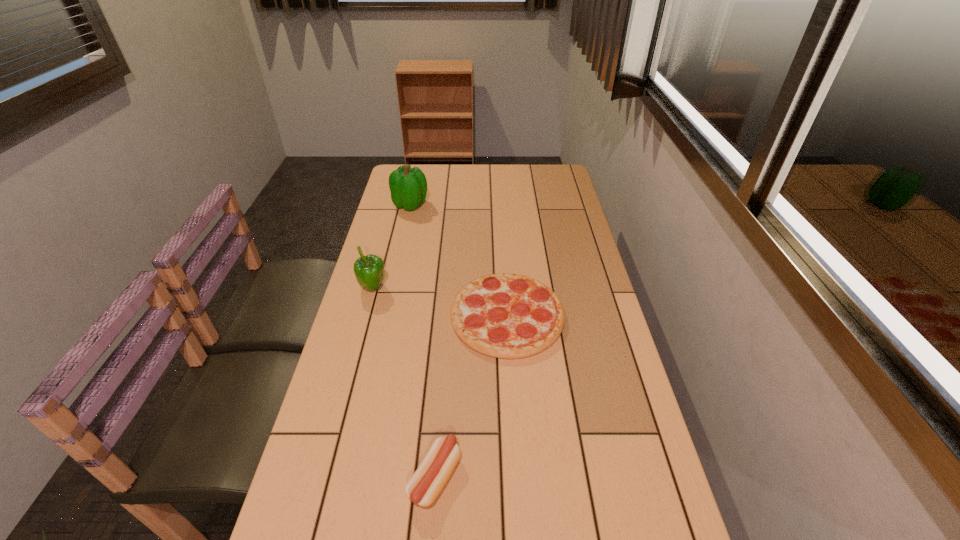
Locate an element on the screen. The height and width of the screenshot is (540, 960). vacant area that lies between the shortest object and the nearer bell pepper is located at coordinates (440, 302).

Where is `unoccupied area between the pizza and the farther bell pepper`? This screenshot has width=960, height=540. unoccupied area between the pizza and the farther bell pepper is located at coordinates (459, 260).

I want to click on empty space between the pizza and the nearest object, so click(x=471, y=396).

The height and width of the screenshot is (540, 960). In order to click on unoccupied area between the pizza and the third tallest object in this screenshot , I will do point(471,396).

Find the location of a particular element. object that stands as the closest to the shortest object is located at coordinates (369, 270).

Identify which object is located as the nearest to the nearer bell pepper. Please provide its 2D coordinates. Your answer should be formatted as a tuple, i.e. [(x, y)], where the tuple contains the x and y coordinates of a point satisfying the conditions above.

[(509, 316)]

Where is `vacant position in the image that satisfies the following two spatial constraints: 1. on the front side of the farther bell pepper; 2. on the right side of the nearest object`? Image resolution: width=960 pixels, height=540 pixels. vacant position in the image that satisfies the following two spatial constraints: 1. on the front side of the farther bell pepper; 2. on the right side of the nearest object is located at coordinates (349, 477).

This screenshot has width=960, height=540. I want to click on free space in the image that satisfies the following two spatial constraints: 1. on the front side of the shortest object; 2. on the right side of the farther bell pepper, so click(386, 316).

Where is `vacant area in the image that satisfies the following two spatial constraints: 1. on the back side of the farther bell pepper; 2. on the right side of the nearer bell pepper`? The width and height of the screenshot is (960, 540). vacant area in the image that satisfies the following two spatial constraints: 1. on the back side of the farther bell pepper; 2. on the right side of the nearer bell pepper is located at coordinates (396, 205).

The height and width of the screenshot is (540, 960). I want to click on free space that satisfies the following two spatial constraints: 1. on the front side of the nearest object; 2. on the left side of the farther bell pepper, so pos(349,477).